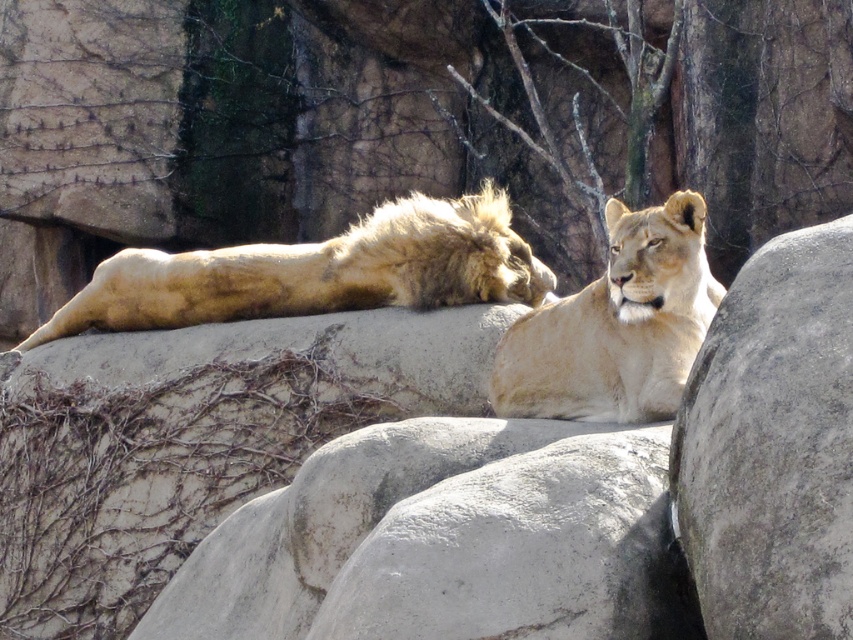
You are a zookeeper who needs to place a new feeding tray that is 1.2 meters wide between the gray rough boulder at right and the light brown fur lioness at center. Based on the scene, will the boulder be wide enough to place the feeding tray next to it?

The gray rough boulder at right has a width less than the light brown fur lioness at center. Since the feeding tray is 1.2 meters wide, and the boulder is narrower than the lioness, it might not be wide enough. However, without knowing the exact width of the lioness, we cannot definitively determine if the boulder can accommodate the feeding tray.

You are a zookeeper trying to place a new feeding tray between the gray rough boulder at right and the light brown fur lioness at center. The feeding tray requires a minimum of 2 meters of space. Can you determine if there is enough space between them?

The gray rough boulder at right has a smaller size compared to light brown fur lioness at center, but the exact distance between them is not provided. Therefore, it is impossible to determine if the feeding tray will fit without additional information.

You are a zookeeper who needs to place a feeding bowl between the gray rough boulder at right and the light brown fur lioness at center. Where should you position the bowl so it is closer to the lioness?

The feeding bowl should be placed between the gray rough boulder at right and the light brown fur lioness at center, closer to the lioness. Since the gray rough boulder at right is to the right of the light brown fur lioness at center, positioning it nearer to the lioness would mean placing it on the left side of the boulder, between them.